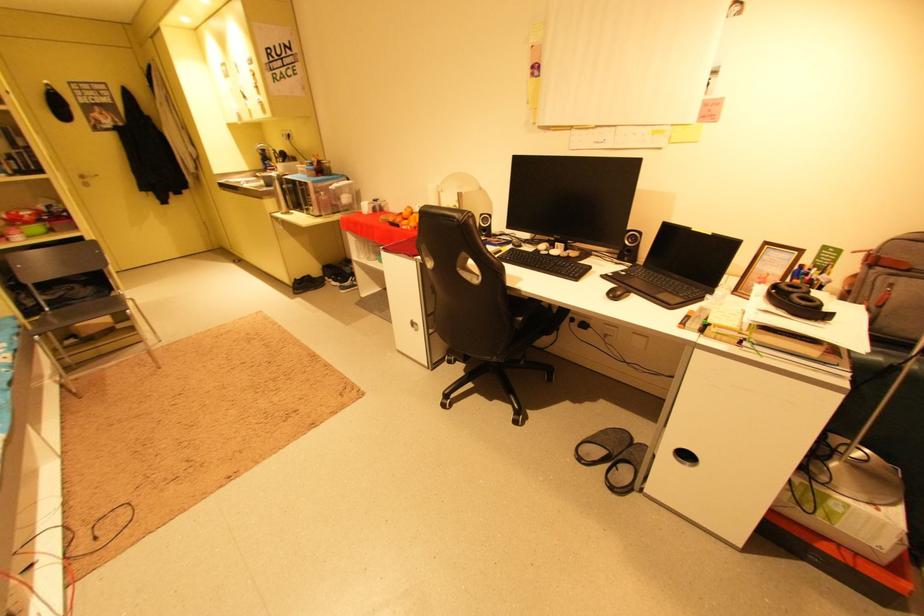
Where would you pull the cabinet cutout handle? Please return your answer as a coordinate pair (x, y).

(414, 325)